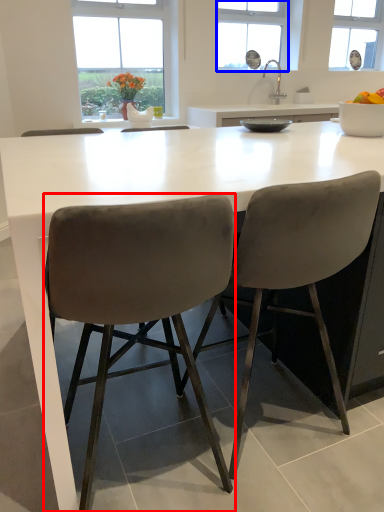
Question: Which point is closer to the camera, chair (highlighted by a red box) or window (highlighted by a blue box)?

Choices:
 (A) chair
 (B) window

Answer: (A)